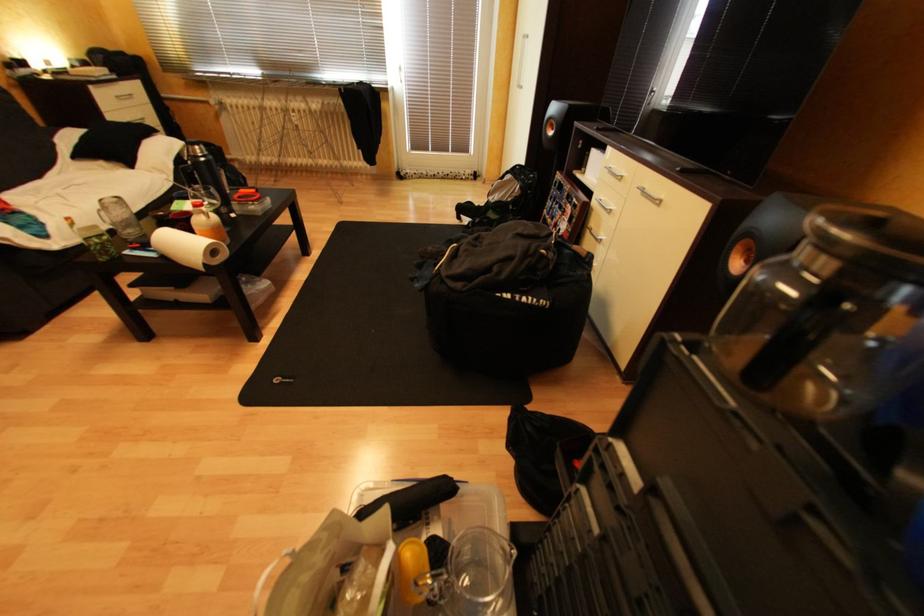
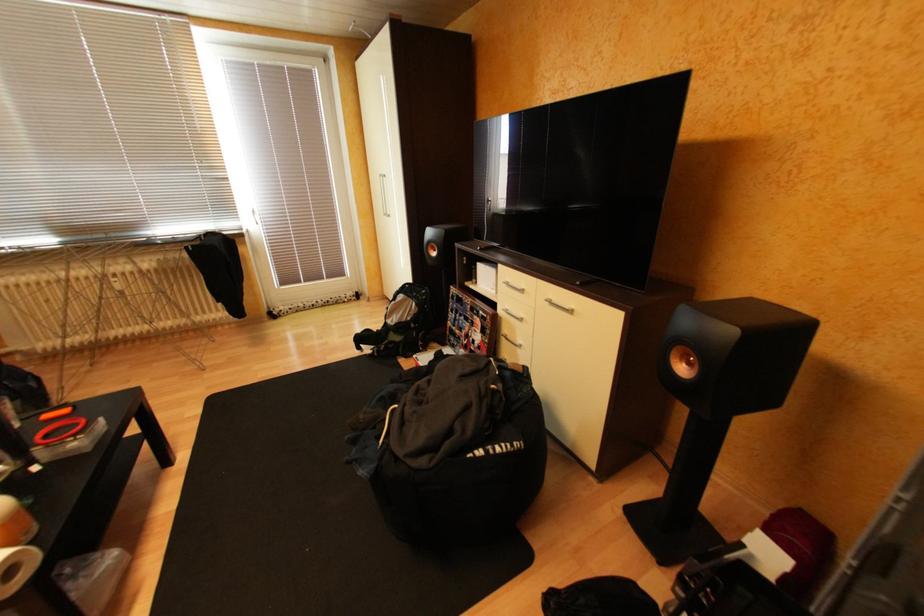
Question: The camera is either moving clockwise (left) or counter-clockwise (right) around the object. The first image is from the beginning of the video and the second image is from the end. Is the camera moving left or right when shooting the video?

Choices:
 (A) Left
 (B) Right

Answer: (A)